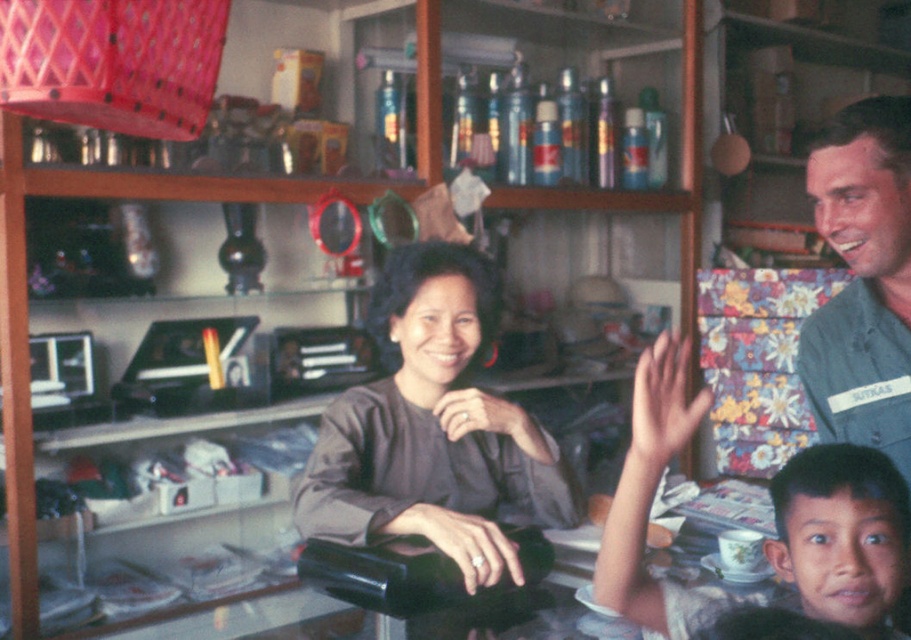
Can you confirm if smooth skin child at center is shorter than dark brown hair at lower right?

No, smooth skin child at center is not shorter than dark brown hair at lower right.

Does smooth skin child at center lie in front of dark brown hair at lower right?

Yes, smooth skin child at center is in front of dark brown hair at lower right.

You are a GUI agent. You are given a task and a screenshot of the screen. Output one action in this format:
    pyautogui.click(x=<x>, y=<y>)
    Task: Click on the smooth skin child at center
    The height and width of the screenshot is (640, 911).
    Given the screenshot: What is the action you would take?
    pyautogui.click(x=841, y=534)

Locate an element on the screen. The height and width of the screenshot is (640, 911). smooth skin child at center is located at coordinates (841, 534).

Consider the image. Can you confirm if gray fabric shirt at center is smaller than dark brown hair at lower right?

No, gray fabric shirt at center is not smaller than dark brown hair at lower right.

Does gray fabric shirt at center appear on the left side of dark brown hair at lower right?

Yes, gray fabric shirt at center is to the left of dark brown hair at lower right.

Between point (539, 435) and point (797, 577), which one is positioned in front?

Point (797, 577)

Where is `gray fabric shirt at center`? The image size is (911, 640). gray fabric shirt at center is located at coordinates (433, 429).

Between gray fabric shirt at center and smooth skin child at center, which one is positioned lower?

smooth skin child at center is below.

Does point (443, 346) lie in front of point (866, 554)?

No, it is behind (866, 554).

Who is more forward, (466,515) or (688,611)?

Positioned in front is point (688,611).

At what (x,y) coordinates should I click in order to perform the action: click on gray fabric shirt at center. Please return your answer as a coordinate pair (x, y). The image size is (911, 640). Looking at the image, I should click on (433, 429).